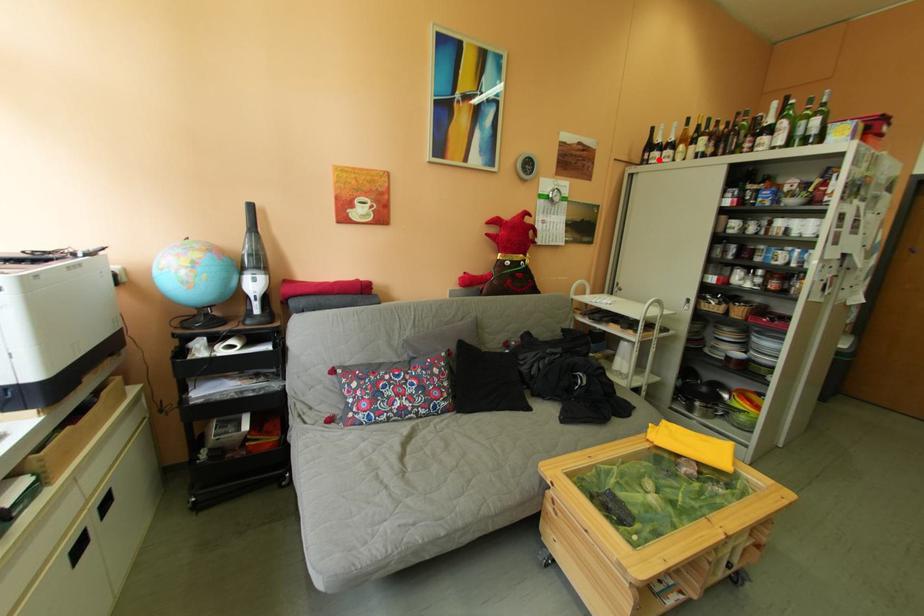
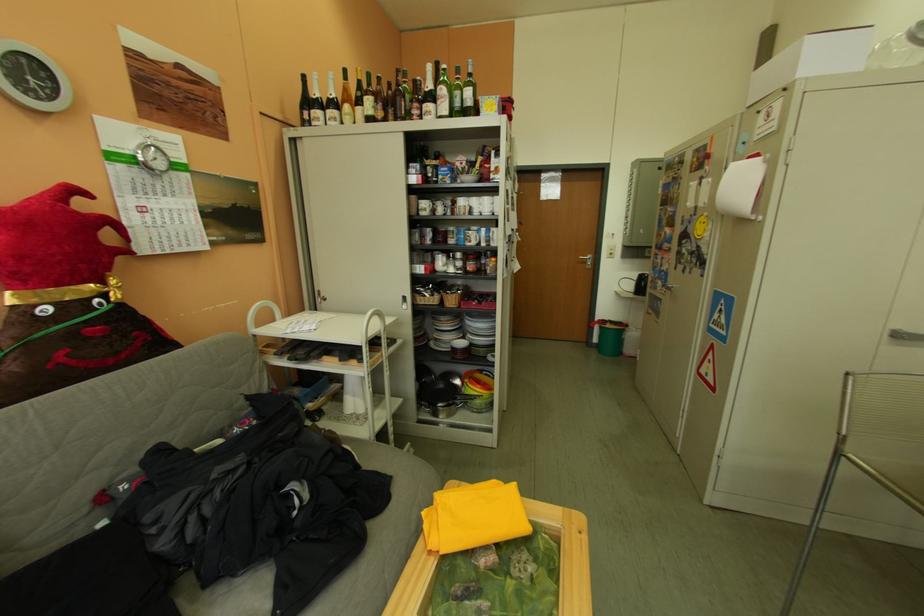
Find the pixel in the second image that matches the highlighted location in the first image.

(320, 120)